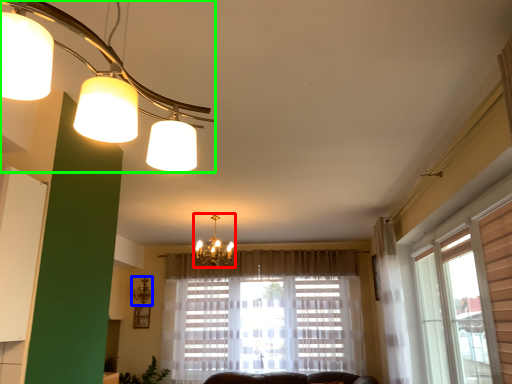
Question: Which object is the closest to the lamp (highlighted by a red box)? Choose among these: lamp (highlighted by a blue box) or lamp (highlighted by a green box).

Choices:
 (A) lamp
 (B) lamp

Answer: (A)